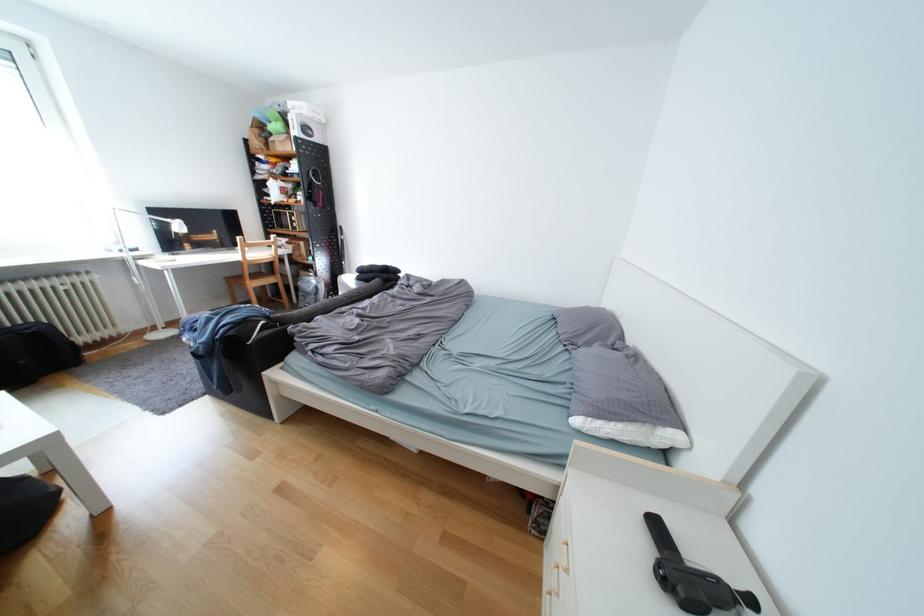
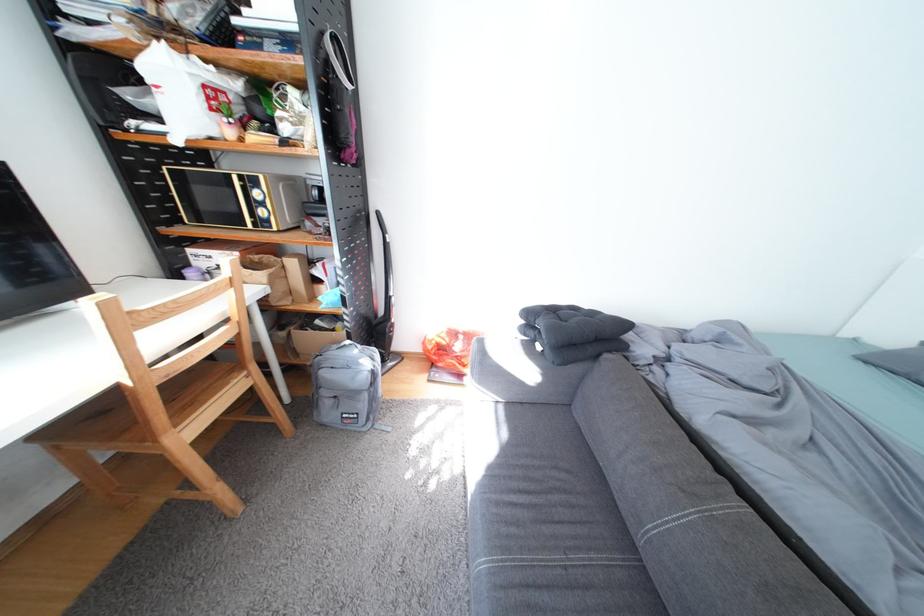
Which direction would the cameraman need to move to produce the second image?

The movement direction of the cameraman is left, forward.